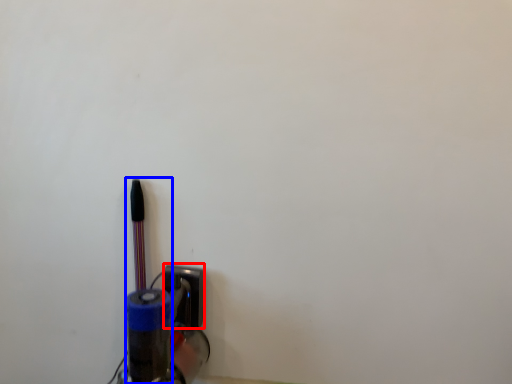
Question: Among these objects, which one is farthest to the camera, socket (highlighted by a red box) or penguin (highlighted by a blue box)?

Choices:
 (A) socket
 (B) penguin

Answer: (A)